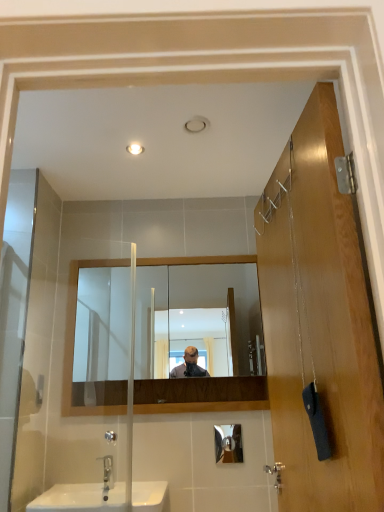
Question: Can you confirm if silver metallic faucet at lower left is smaller than clear glass mirror at center?

Choices:
 (A) yes
 (B) no

Answer: (A)

Question: Does silver metallic faucet at lower left turn towards clear glass mirror at center?

Choices:
 (A) no
 (B) yes

Answer: (A)

Question: Is silver metallic faucet at lower left to the left of clear glass mirror at center from the viewer's perspective?

Choices:
 (A) no
 (B) yes

Answer: (B)

Question: Does silver metallic faucet at lower left lie behind clear glass mirror at center?

Choices:
 (A) yes
 (B) no

Answer: (B)

Question: Does silver metallic faucet at lower left have a greater height compared to clear glass mirror at center?

Choices:
 (A) yes
 (B) no

Answer: (B)

Question: From the image's perspective, would you say silver metallic faucet at lower left is shown under clear glass mirror at center?

Choices:
 (A) no
 (B) yes

Answer: (B)

Question: Is wooden door at right at the right side of white glossy sink at lower left?

Choices:
 (A) yes
 (B) no

Answer: (A)

Question: Does wooden door at right have a larger size compared to white glossy sink at lower left?

Choices:
 (A) yes
 (B) no

Answer: (A)

Question: Is wooden door at right positioned behind white glossy sink at lower left?

Choices:
 (A) yes
 (B) no

Answer: (B)

Question: Is wooden door at right to the left of white glossy sink at lower left from the viewer's perspective?

Choices:
 (A) yes
 (B) no

Answer: (B)

Question: From a real-world perspective, is wooden door at right on white glossy sink at lower left?

Choices:
 (A) no
 (B) yes

Answer: (B)

Question: From a real-world perspective, is wooden door at right positioned under white glossy sink at lower left based on gravity?

Choices:
 (A) yes
 (B) no

Answer: (B)

Question: Can you confirm if silver metallic faucet at lower left is shorter than wooden door at right?

Choices:
 (A) yes
 (B) no

Answer: (A)